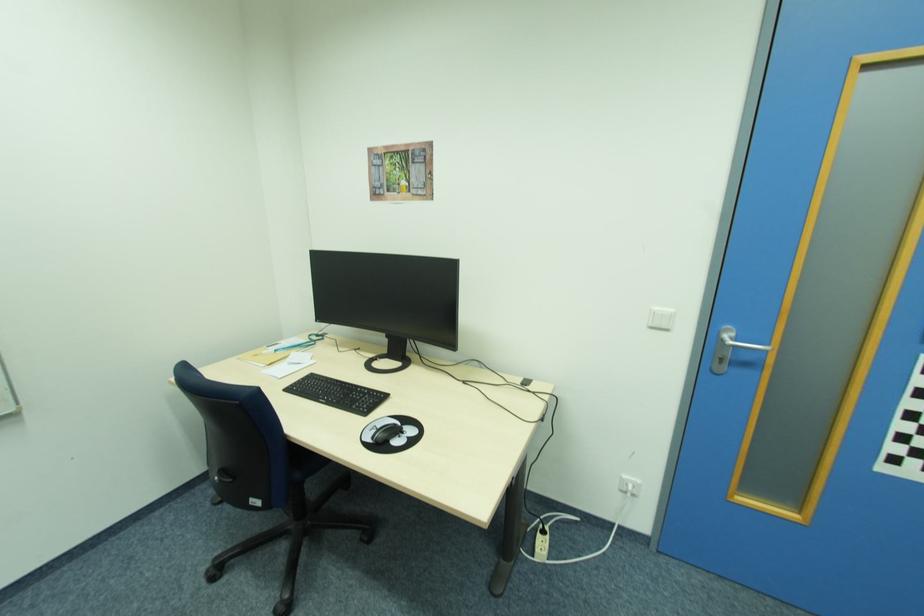
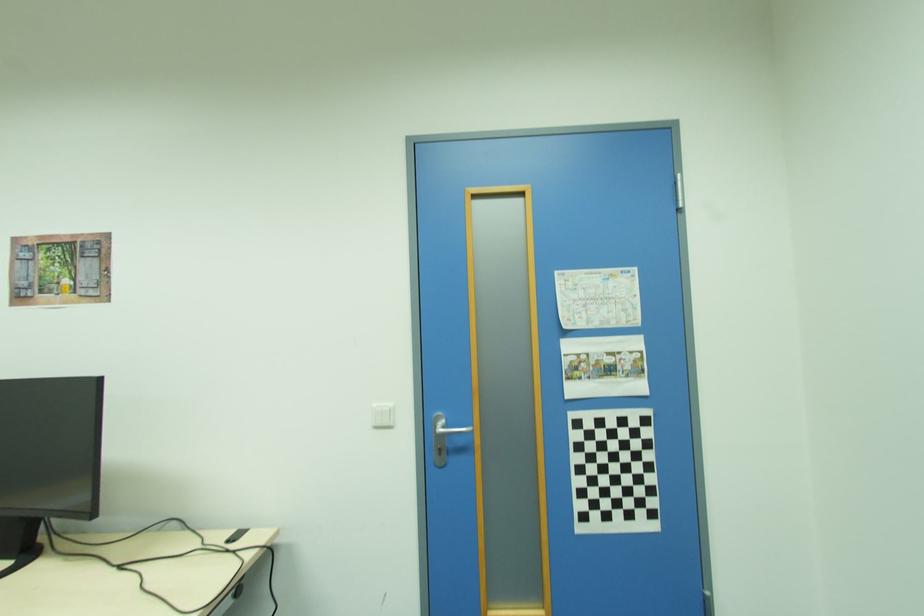
Where in the second image is the point corresponding to the point at 725,339 from the first image?

(439, 429)